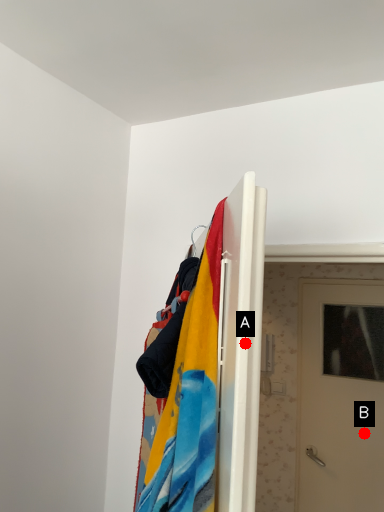
Question: Two points are circled on the image, labeled by A and B beside each circle. Which point appears closest to the camera in this image?

Choices:
 (A) A is closer
 (B) B is closer

Answer: (A)